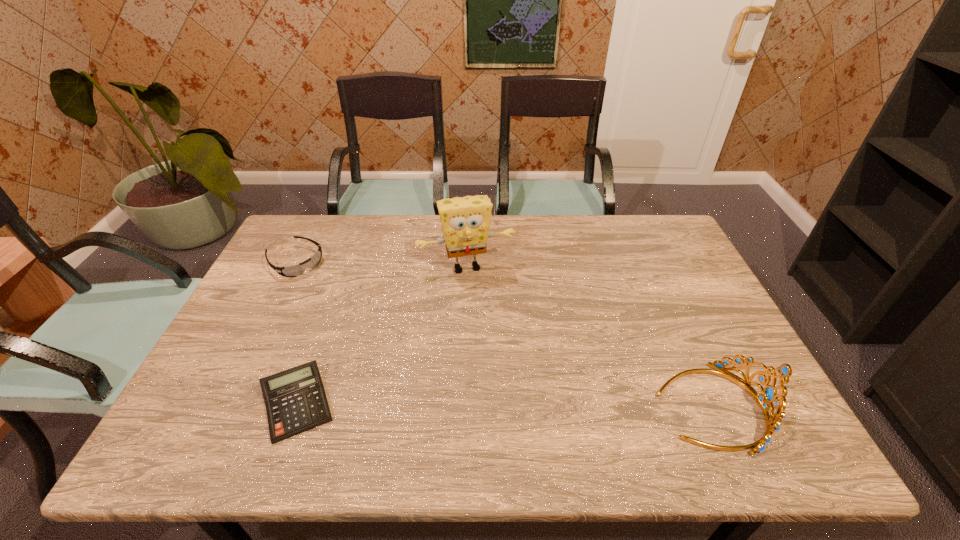
Where is `object that is at the far left corner`? object that is at the far left corner is located at coordinates (x=297, y=270).

The height and width of the screenshot is (540, 960). Find the location of `object present at the near left corner`. object present at the near left corner is located at coordinates (295, 399).

Where is `object that is positioned at the near right corner`? object that is positioned at the near right corner is located at coordinates (769, 395).

The image size is (960, 540). In the image, there is a desktop. Identify the location of vacant space at the far edge. (417, 219).

In the image, there is a desktop. Where is `vacant space at the near edge`? vacant space at the near edge is located at coordinates (573, 383).

In the image, there is a desktop. Identify the location of free space at the left edge. (272, 320).

What are the coordinates of `free region at the right edge of the desktop` in the screenshot? It's located at (721, 380).

Identify the location of vacant area that lies between the sunglasses and the shortest object. (297, 333).

Where is `empty location between the sunglasses and the shortest object`? The height and width of the screenshot is (540, 960). empty location between the sunglasses and the shortest object is located at coordinates (297, 333).

Locate an element on the screen. This screenshot has height=540, width=960. free space that is in between the sunglasses and the rightmost object is located at coordinates (503, 334).